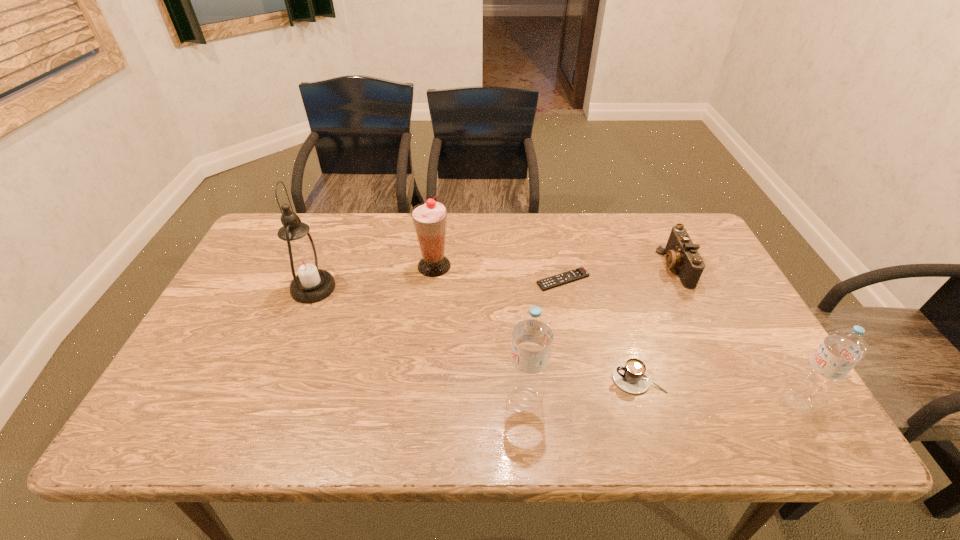
Please point a free position for a water bottle on the left. Please provide its 2D coordinates. Your answer should be formatted as a tuple, i.e. [(x, y)], where the tuple contains the x and y coordinates of a point satisfying the conditions above.

[(253, 400)]